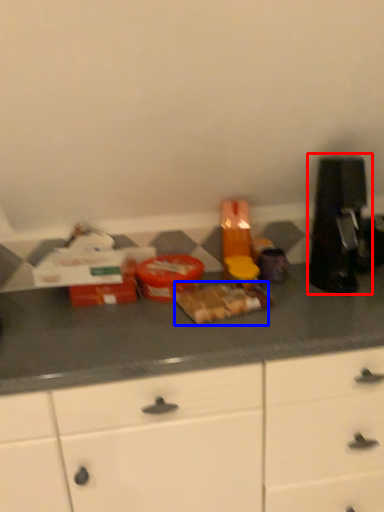
Question: Which point is further to the camera, coffee machine (highlighted by a red box) or food (highlighted by a blue box)?

Choices:
 (A) coffee machine
 (B) food

Answer: (A)